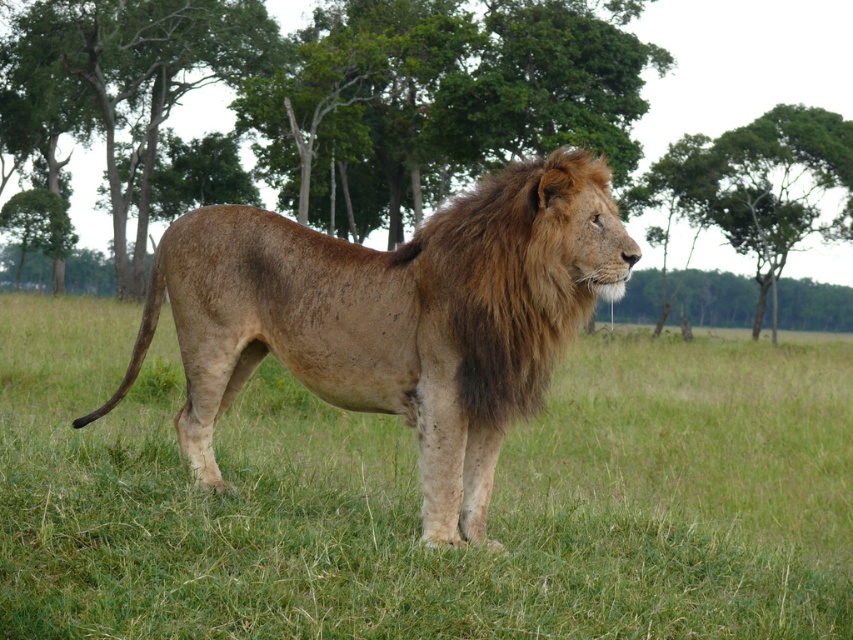
Based on the photo, you are a photographer trying to capture the lion in the image. You want to position yourself so that the lion is between the green grass at center and the green leafy tree at center. Is this possible based on their positions?

The green grass at center is to the left of the green leafy tree at center, so positioning the lion between them would require placing the lion to the right of the green grass at center and to the left of the green leafy tree at center, which is possible based on their spatial arrangement.

You are a bird flying over the savanna and want to land on the tallest tree. Which tree should you choose between the green leafy tree at center and the green leafy tree at upper center?

The green leafy tree at center is taller than the green leafy tree at upper center, so you should choose the green leafy tree at center to land on.

You are a small rabbit looking for a hiding spot in the savanna. You see the green grass at center and the green leafy tree at center. Which one would provide a larger area to hide in?

The green leafy tree at center occupies more space than the green grass at center, so it would provide a larger area to hide in.